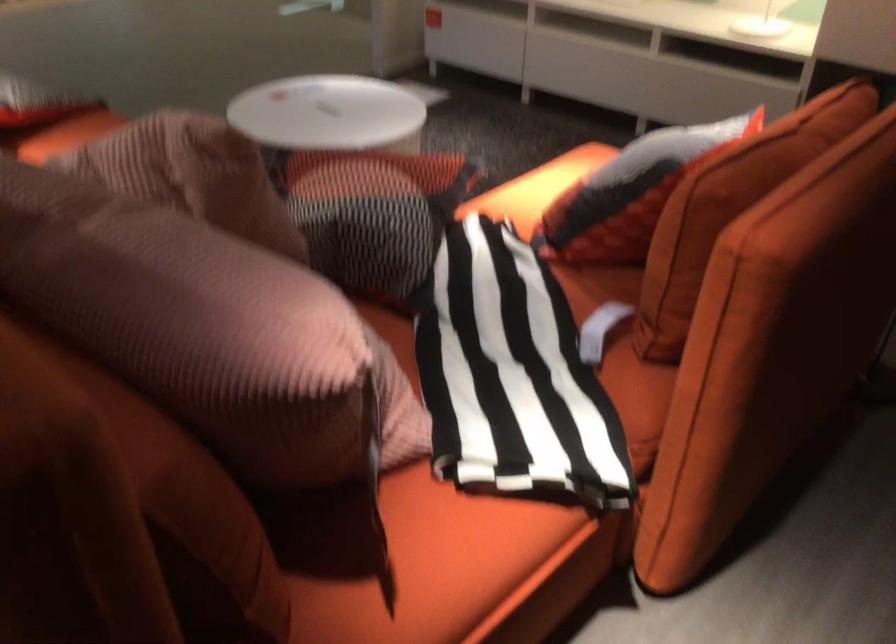
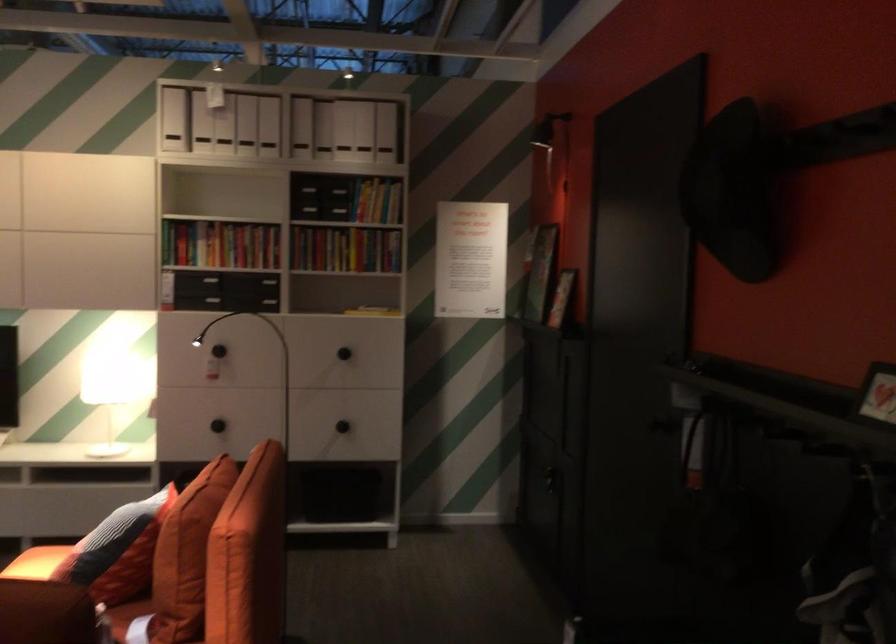
Locate, in the second image, the point that corresponds to [579,160] in the first image.

(36, 563)